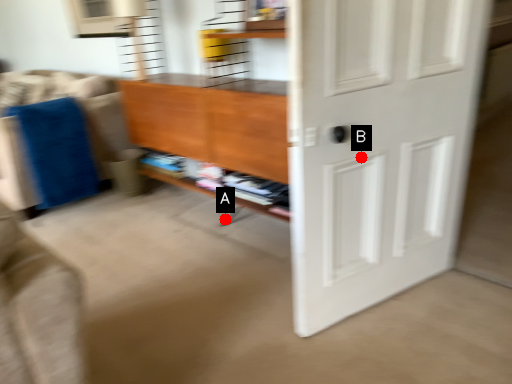
Question: Two points are circled on the image, labeled by A and B beside each circle. Which point is farther to the camera?

Choices:
 (A) A is further
 (B) B is further

Answer: (A)